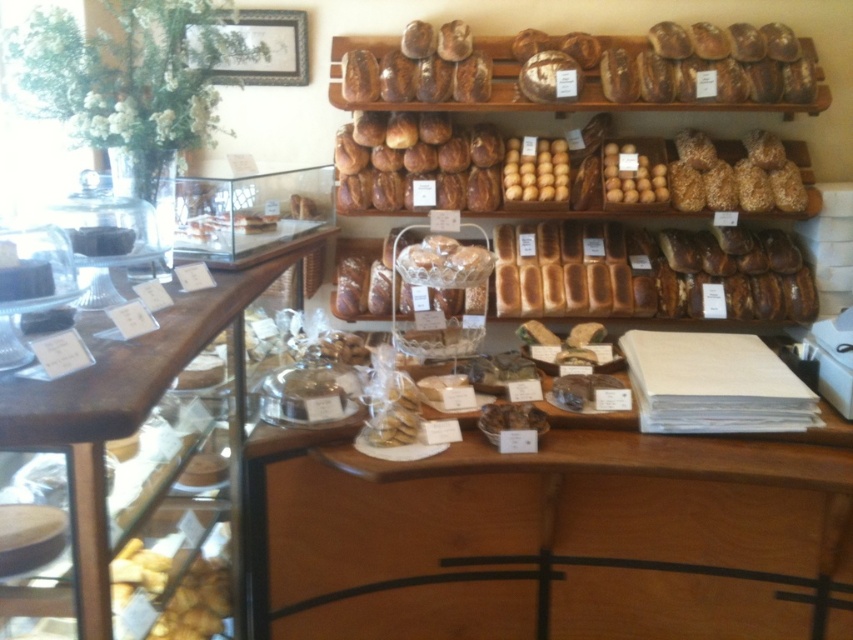
Is baked golden-brown loaf at upper center wider than golden brown crumbly pastry at lower left?

Correct, the width of baked golden-brown loaf at upper center exceeds that of golden brown crumbly pastry at lower left.

Consider the image. Is the position of baked golden-brown loaf at upper center more distant than that of golden brown crumbly pastry at lower left?

Yes, it is behind golden brown crumbly pastry at lower left.

Which is behind, point (494, 49) or point (199, 566)?

Point (494, 49)

Find the location of `baked golden-brown loaf at upper center`. baked golden-brown loaf at upper center is located at coordinates (595, 68).

Does point (195, 612) lie behind point (508, 412)?

No, it is in front of (508, 412).

Is golden brown crumbly pastry at lower left shorter than brown crumbly pastry at center?

No.

At what (x,y) coordinates should I click in order to perform the action: click on golden brown crumbly pastry at lower left. Please return your answer as a coordinate pair (x, y). The height and width of the screenshot is (640, 853). Looking at the image, I should click on (195, 602).

Consider the image. Between baked golden-brown loaf at upper center and golden brown crusty loaf at upper center, which one is positioned higher?

baked golden-brown loaf at upper center is above.

Measure the distance between baked golden-brown loaf at upper center and golden brown crusty loaf at upper center.

12.30 inches

Measure the distance between baked golden-brown loaf at upper center and camera.

baked golden-brown loaf at upper center is 2.57 meters away from camera.

The height and width of the screenshot is (640, 853). I want to click on baked golden-brown loaf at upper center, so click(x=595, y=68).